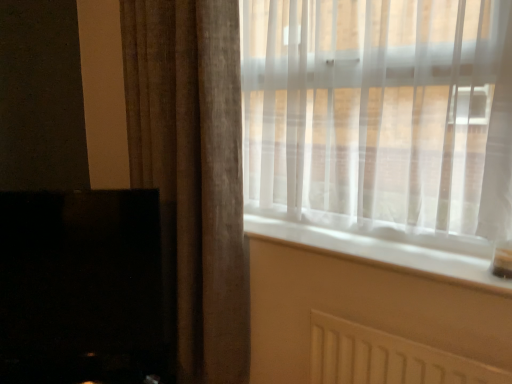
Find the location of a particular element. The image size is (512, 384). free space above white smooth window sill at center (from a real-world perspective) is located at coordinates (342, 236).